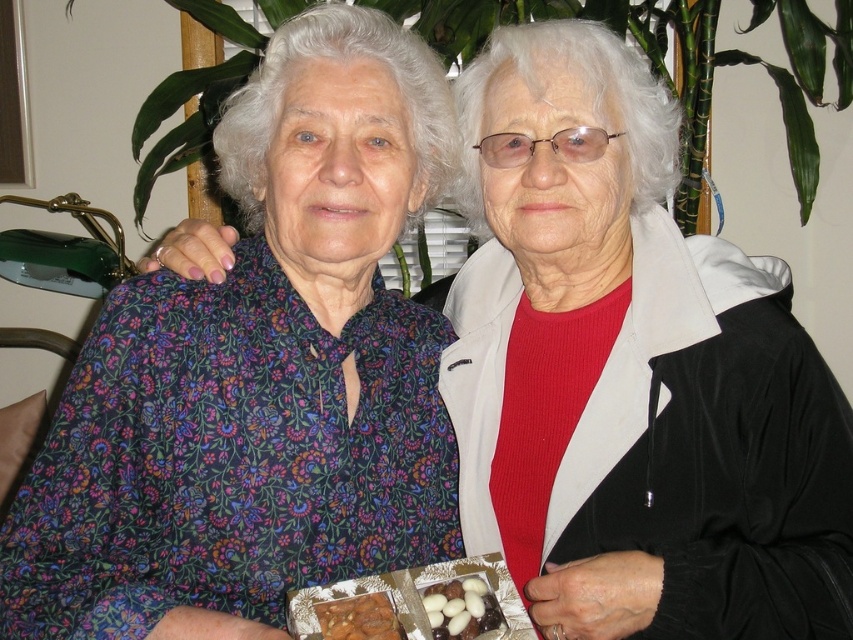
What do you see at coordinates (630, 371) in the screenshot? I see `matte black jacket at right` at bounding box center [630, 371].

Is matte black jacket at right positioned at the back of floral fabric blouse at left?

Yes, matte black jacket at right is further from the viewer.

Does point (532, 440) come farther from viewer compared to point (223, 417)?

Yes, it is behind point (223, 417).

Locate an element on the screen. Image resolution: width=853 pixels, height=640 pixels. matte black jacket at right is located at coordinates (630, 371).

Is point (326, 228) closer to viewer compared to point (434, 618)?

No.

Does floral fabric blouse at left lie behind white glossy candy at lower center?

No, it is not.

Where is `floral fabric blouse at left`? The image size is (853, 640). floral fabric blouse at left is located at coordinates (259, 372).

Between white glossy candy at lower center and chocolate-coated nuts at lower center, which one is positioned higher?

white glossy candy at lower center is higher up.

Between white glossy candy at lower center and chocolate-coated nuts at lower center, which one is positioned lower?

chocolate-coated nuts at lower center is lower down.

Does point (469, 592) come behind point (390, 611)?

Yes, point (469, 592) is behind point (390, 611).

The width and height of the screenshot is (853, 640). What are the coordinates of `white glossy candy at lower center` in the screenshot? It's located at (461, 609).